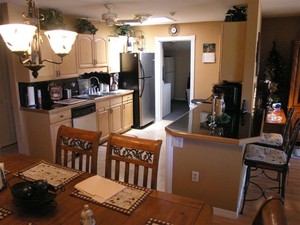
The height and width of the screenshot is (225, 300). Find the location of `paper towels`. paper towels is located at coordinates (31, 98).